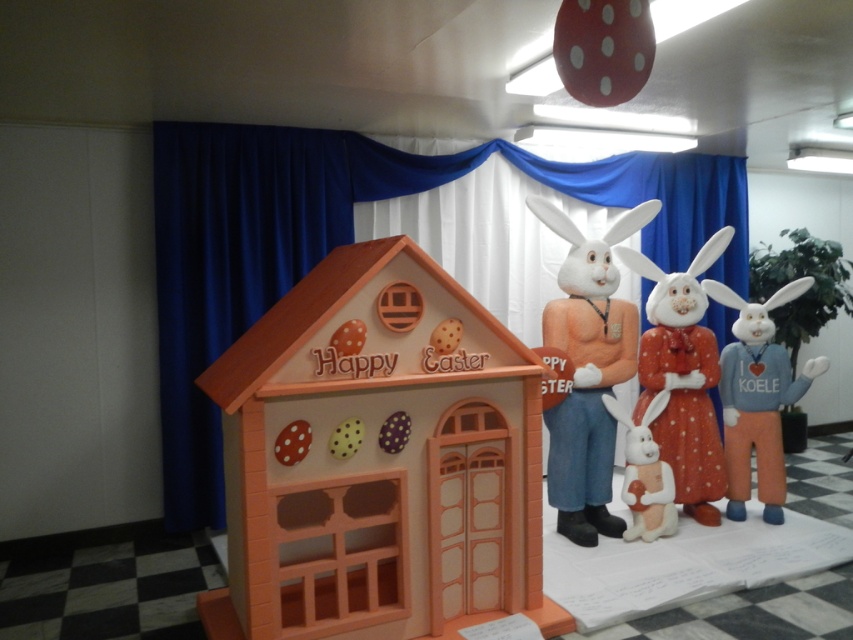
Does matte orange house at center have a greater height compared to white plush bunny at center?

Yes.

Can you confirm if matte orange house at center is positioned below white plush bunny at center?

Incorrect, matte orange house at center is not positioned below white plush bunny at center.

Is point (326, 486) farther from viewer compared to point (636, 481)?

No.

Find the location of `matte orange house at center`. matte orange house at center is located at coordinates (378, 460).

Who is more forward, (761, 326) or (676, 522)?

Point (676, 522) is more forward.

Which is in front, point (817, 358) or point (624, 413)?

Positioned in front is point (624, 413).

The image size is (853, 640). Identify the location of white matte plush at center. (757, 397).

Is white plush rabbit at center bigger than white matte plush at center?

Yes, white plush rabbit at center is bigger than white matte plush at center.

Image resolution: width=853 pixels, height=640 pixels. Find the location of `white plush rabbit at center`. white plush rabbit at center is located at coordinates (587, 371).

Image resolution: width=853 pixels, height=640 pixels. I want to click on white plush rabbit at center, so click(x=587, y=371).

This screenshot has width=853, height=640. Identify the location of white plush rabbit at center. (587, 371).